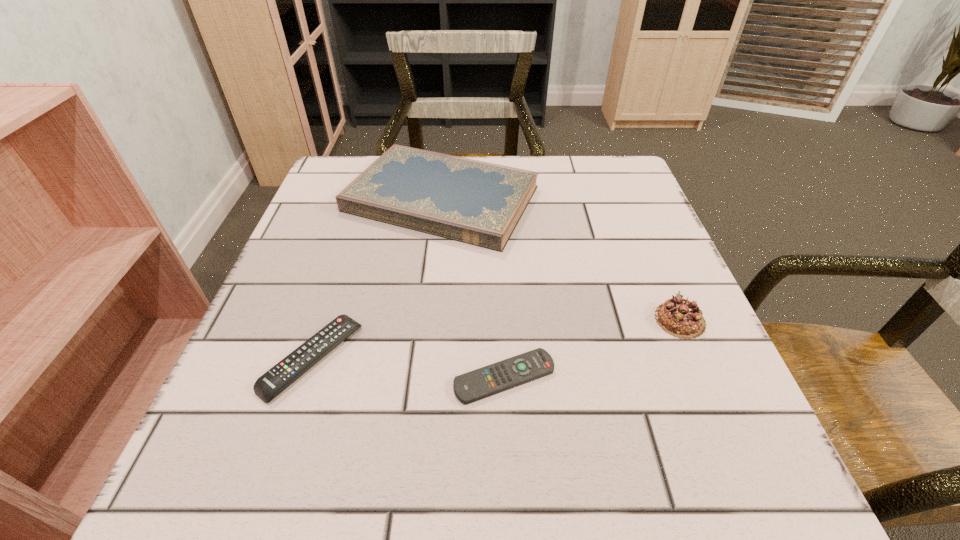
Locate an element on the screen. The height and width of the screenshot is (540, 960). object present at the far edge is located at coordinates [x=480, y=203].

Find the location of a particular element. The width and height of the screenshot is (960, 540). paperback book located at the left edge is located at coordinates click(x=480, y=203).

At what (x,y) coordinates should I click in order to perform the action: click on remote control present at the left edge. Please return your answer as a coordinate pair (x, y). Image resolution: width=960 pixels, height=540 pixels. Looking at the image, I should click on (268, 386).

Identify the location of object at the right edge. (679, 317).

The height and width of the screenshot is (540, 960). In order to click on object that is at the far left corner in this screenshot , I will do `click(480, 203)`.

Image resolution: width=960 pixels, height=540 pixels. In the image, there is a desktop. Identify the location of vacant space at the near edge. (617, 500).

Locate an element on the screen. The height and width of the screenshot is (540, 960). free space at the left edge of the desktop is located at coordinates (259, 330).

This screenshot has height=540, width=960. What are the coordinates of `free location at the right edge of the desktop` in the screenshot? It's located at (702, 373).

In the image, there is a desktop. Where is `vacant space at the far left corner`? This screenshot has height=540, width=960. vacant space at the far left corner is located at coordinates (331, 201).

Image resolution: width=960 pixels, height=540 pixels. What are the coordinates of `vacant position at the near left corner of the desktop` in the screenshot? It's located at (261, 463).